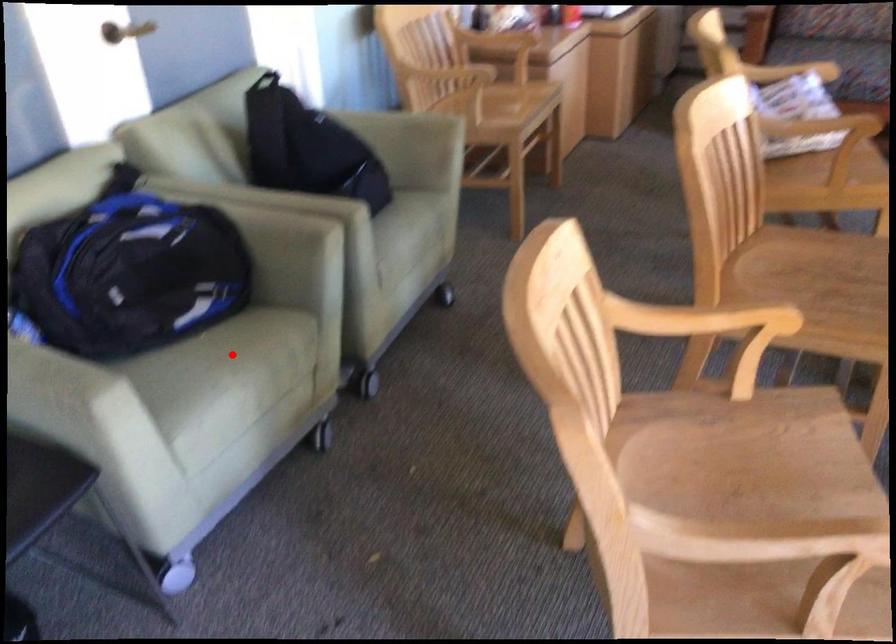
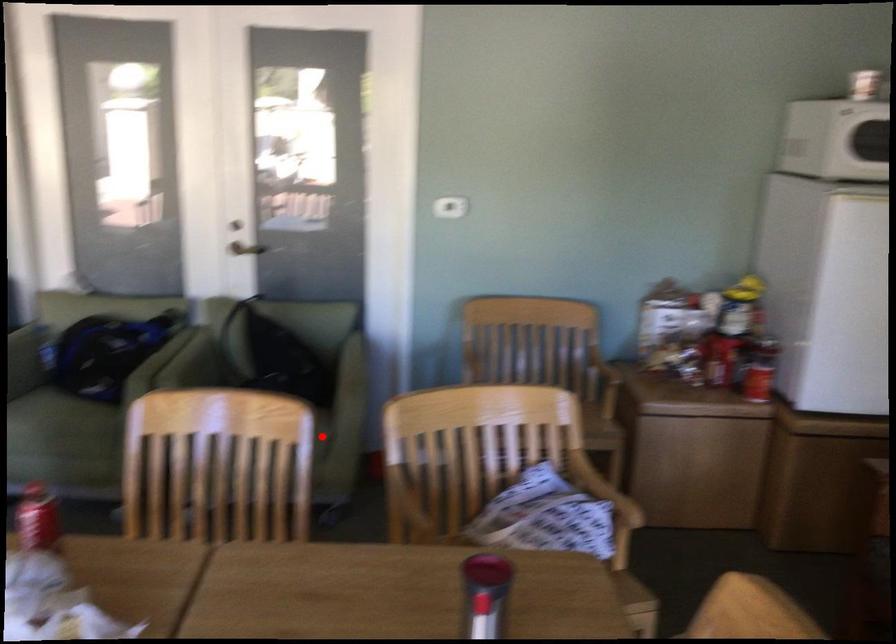
I am providing you with two images of the same scene from different viewpoints. A red point is marked on the first image and another point is marked on the second image. Is the marked point in image1 the same physical position as the marked point in image2?

No